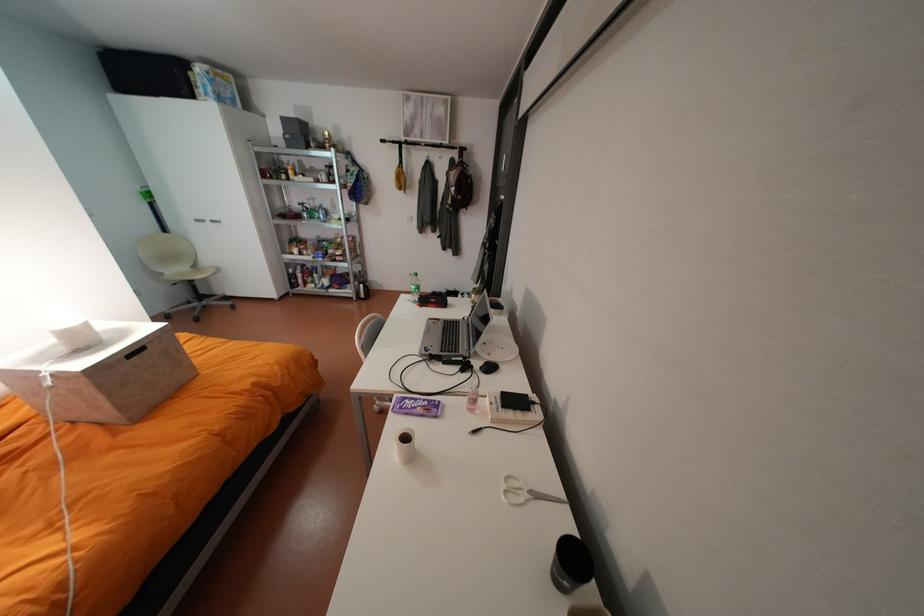
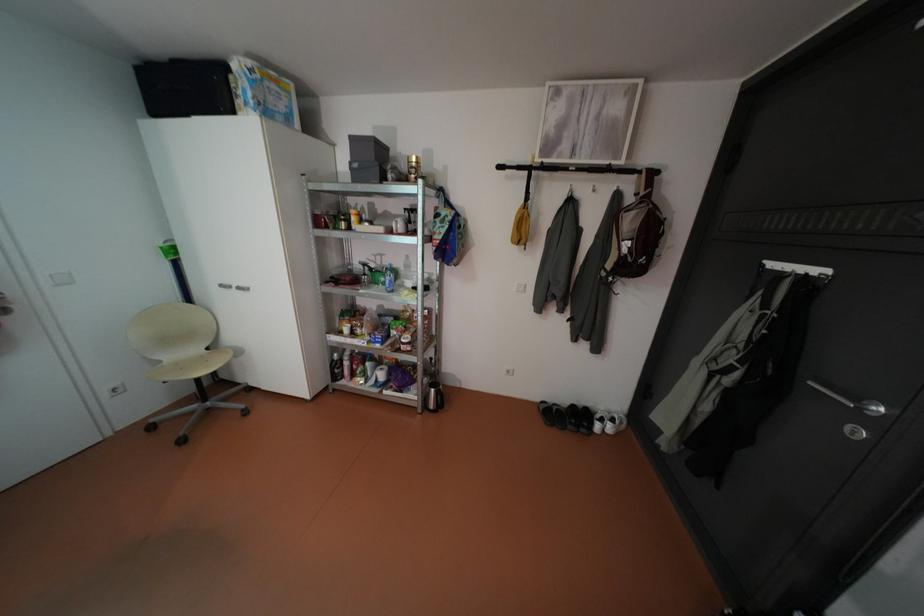
The images are taken continuously from a first-person perspective. In which direction are you moving?

The cameraman walked toward left, forward.